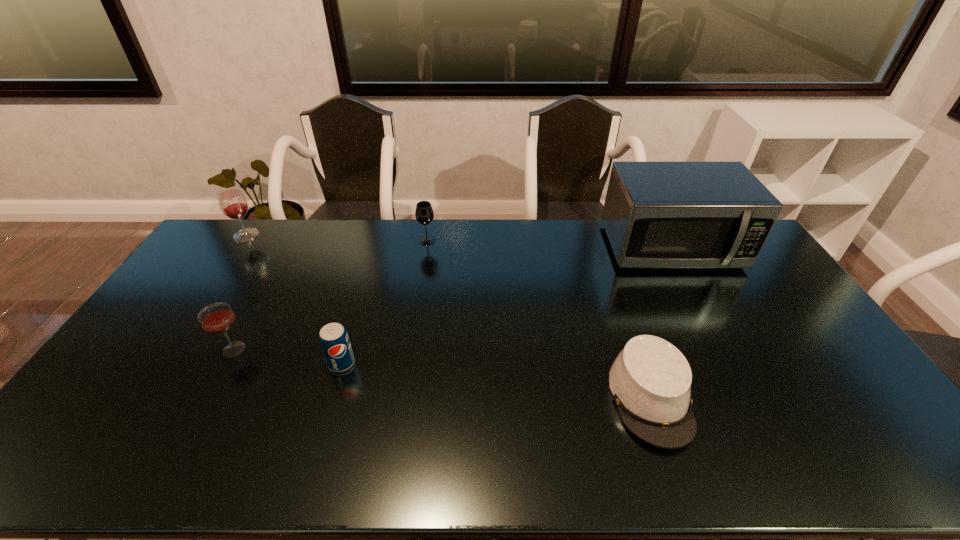
Where is `vacant space situated 0.250m on the back of the second wineglass from right to left`? The image size is (960, 540). vacant space situated 0.250m on the back of the second wineglass from right to left is located at coordinates (270, 282).

Locate an element on the screen. vacant space located on the right of the pop is located at coordinates (475, 363).

At what (x,y) coordinates should I click in order to perform the action: click on microwave oven at the far edge. Please return your answer as a coordinate pair (x, y). This screenshot has height=540, width=960. Looking at the image, I should click on (656, 214).

In order to click on object located at the near edge in this screenshot , I will do `click(650, 379)`.

This screenshot has width=960, height=540. In order to click on object that is at the left edge in this screenshot , I will do coord(233,204).

Find the location of a particular element. object at the right edge is located at coordinates (656, 214).

Where is `object that is at the far left corner`? The height and width of the screenshot is (540, 960). object that is at the far left corner is located at coordinates (233, 204).

Locate an element on the screen. This screenshot has height=540, width=960. object present at the far right corner is located at coordinates (656, 214).

Identify the location of blank space at the far edge of the desktop. The width and height of the screenshot is (960, 540). (488, 226).

In the image, there is a desktop. At what (x,y) coordinates should I click in order to perform the action: click on free space at the near edge. Please return your answer as a coordinate pair (x, y). Looking at the image, I should click on (224, 457).